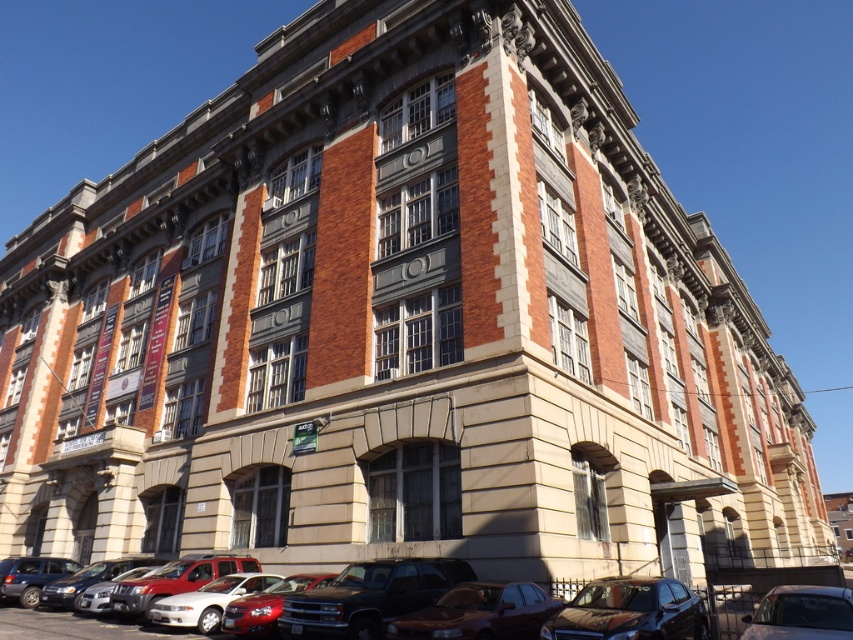
Question: Which object is positioned closest to the satin brown sedan at lower center?

Choices:
 (A) shiny red sedan at lower center
 (B) shiny red sedan at center
 (C) matte black suv at lower left

Answer: (B)

Question: Is shiny black suv at lower center wider than shiny red sedan at lower center?

Choices:
 (A) yes
 (B) no

Answer: (B)

Question: Is shiny silver sedan at lower right smaller than white glossy sedan at lower center?

Choices:
 (A) yes
 (B) no

Answer: (B)

Question: Is satin brown sedan at lower center to the right of shiny red sedan at center from the viewer's perspective?

Choices:
 (A) no
 (B) yes

Answer: (A)

Question: Which point is farther to the camera?

Choices:
 (A) shiny red sedan at center
 (B) shiny black sedan at lower center
 (C) matte black suv at lower left
 (D) shiny silver sedan at lower right

Answer: (C)

Question: Considering the real-world distances, which object is closest to the satin brown sedan at lower center?

Choices:
 (A) shiny silver sedan at lower right
 (B) shiny red sedan at center
 (C) white glossy sedan at lower center

Answer: (A)